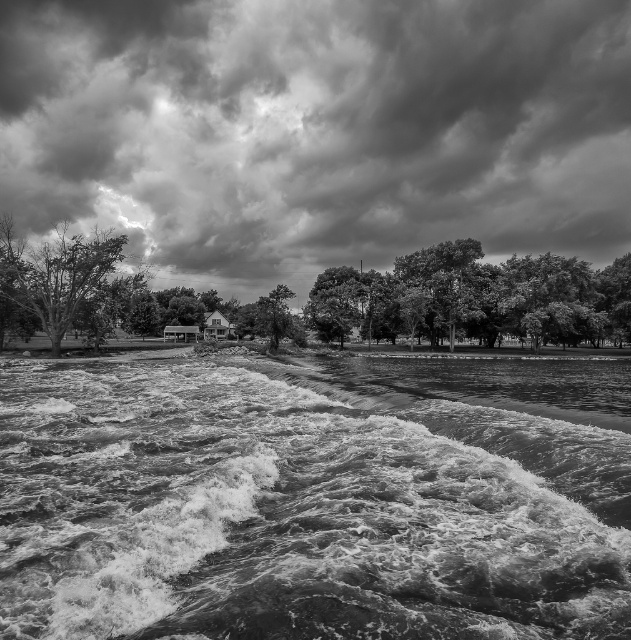
Based on the scene described, which tree at the center is taller between the dark green leafy tree at center and the smooth bark tree at center?

The dark green leafy tree at center is taller than the smooth bark tree at center according to the description.

You are standing at the point with coordinates point (257, 328) and want to see the point with coordinates point (50, 317). Can you see it without any obstruction?

Point (50, 317) is in front of point (257, 328), so yes, you can see it without any obstruction.

You are standing at the center of the image. Which direction should you look to see the smooth bark tree at left?

The smooth bark tree at left is located at the lower left side of the image, so you should look to your left to see it.